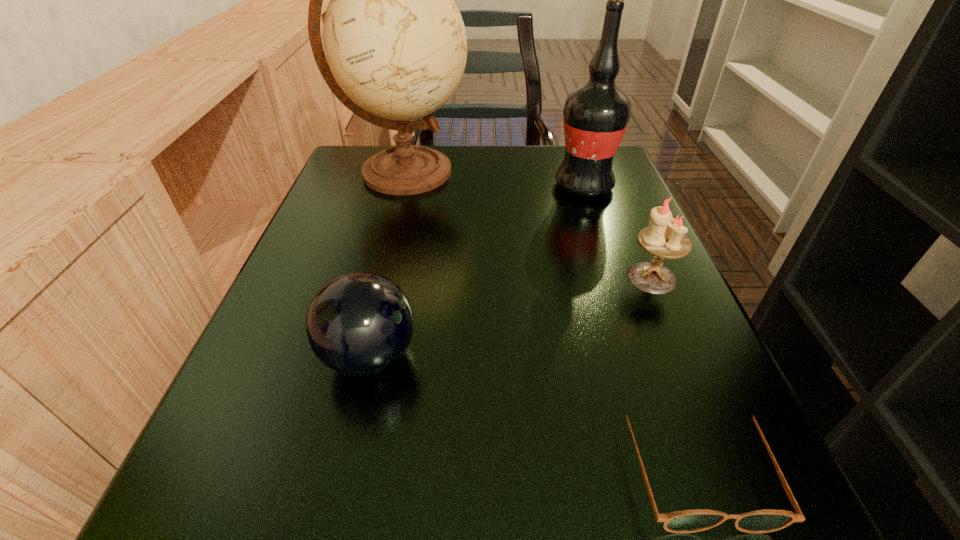
Where is `vacant space located on the side of the fourth tallest object with the finger holes`? This screenshot has height=540, width=960. vacant space located on the side of the fourth tallest object with the finger holes is located at coordinates (470, 356).

In order to click on globe located in the far edge section of the desktop in this screenshot , I will do `click(395, 42)`.

At what (x,y) coordinates should I click in order to perform the action: click on wine bottle positioned at the far edge. Please return your answer as a coordinate pair (x, y). The image size is (960, 540). Looking at the image, I should click on (595, 116).

Where is `object located in the near edge section of the desktop`? object located in the near edge section of the desktop is located at coordinates (687, 521).

Where is `globe located in the left edge section of the desktop`? The width and height of the screenshot is (960, 540). globe located in the left edge section of the desktop is located at coordinates (395, 42).

Find the location of a particular element. bowling ball situated at the left edge is located at coordinates (359, 324).

Locate an element on the screen. wine bottle that is positioned at the right edge is located at coordinates (595, 116).

Find the location of `candle holder that is at the right edge`. candle holder that is at the right edge is located at coordinates (664, 238).

This screenshot has width=960, height=540. Find the location of `sunglasses that is at the right edge`. sunglasses that is at the right edge is located at coordinates (687, 521).

Identify the location of object that is at the far left corner. Image resolution: width=960 pixels, height=540 pixels. (395, 42).